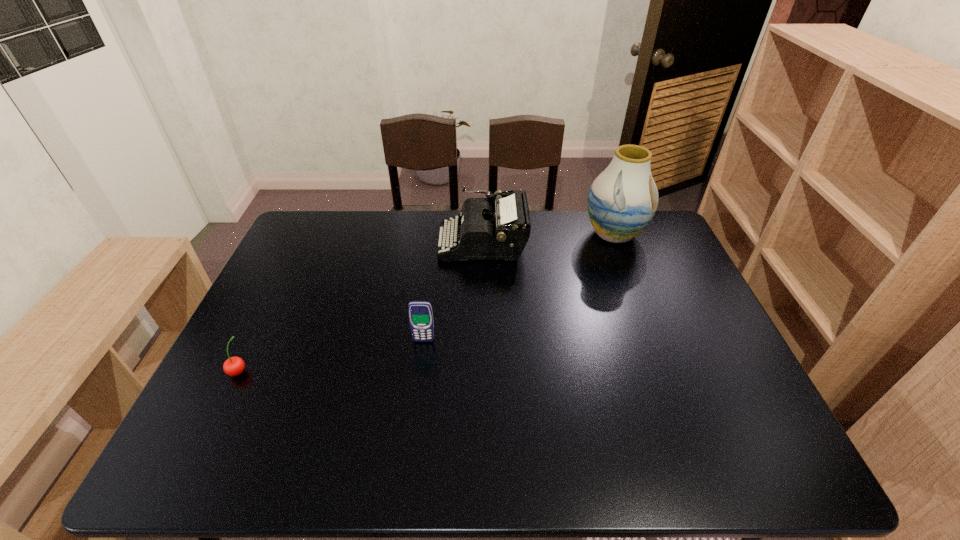
At what (x,y) coordinates should I click in order to perform the action: click on vase. Please return your answer as a coordinate pair (x, y). This screenshot has height=540, width=960. Looking at the image, I should click on (622, 200).

Where is `the tallest object`? Image resolution: width=960 pixels, height=540 pixels. the tallest object is located at coordinates point(622,200).

Identify the location of typewriter. The image size is (960, 540). (487, 233).

This screenshot has width=960, height=540. In order to click on the second nearest object in this screenshot , I will do `click(420, 313)`.

Find the location of `the leftmost object`. the leftmost object is located at coordinates (234, 366).

Identify the location of cherry. The image size is (960, 540). (234, 366).

The height and width of the screenshot is (540, 960). I want to click on blank area located 0.060m on the front of the rightmost object, so click(x=626, y=266).

This screenshot has height=540, width=960. What are the coordinates of `free spot located 0.110m on the typing side of the typewriter` in the screenshot? It's located at (407, 241).

Image resolution: width=960 pixels, height=540 pixels. I want to click on vacant region located 0.320m on the typing side of the typewriter, so click(x=345, y=241).

Where is `vacant area situated on the typing side of the typewriter`? The width and height of the screenshot is (960, 540). vacant area situated on the typing side of the typewriter is located at coordinates (407, 241).